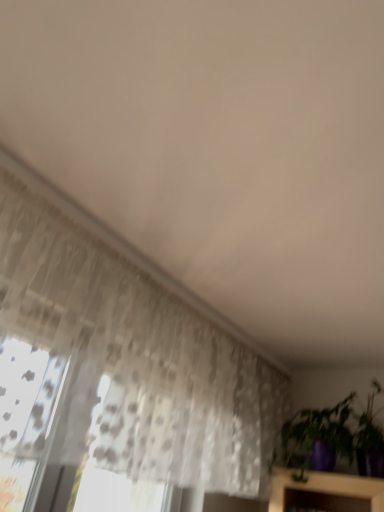
Locate an element on the screen. The height and width of the screenshot is (512, 384). purple glossy vase at lower right is located at coordinates 332,438.

The width and height of the screenshot is (384, 512). What do you see at coordinates (332, 438) in the screenshot? I see `purple glossy vase at lower right` at bounding box center [332, 438].

Where is `purple glossy vase at lower right`? The height and width of the screenshot is (512, 384). purple glossy vase at lower right is located at coordinates (332, 438).